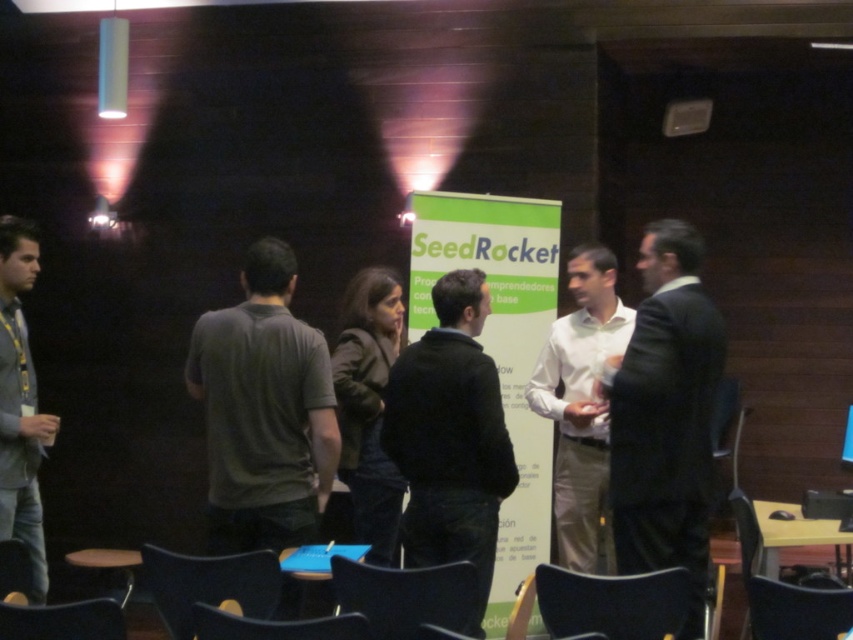
Does dark blue sweater at center lie behind matte black chair at lower left?

That is True.

Between dark blue sweater at center and matte black chair at lower left, which one has less height?

With less height is matte black chair at lower left.

Measure the distance between dark blue sweater at center and camera.

The distance of dark blue sweater at center from camera is 8.73 feet.

At what (x,y) coordinates should I click in order to perform the action: click on dark blue sweater at center. Please return your answer as a coordinate pair (x, y). The image size is (853, 640). Looking at the image, I should click on (450, 436).

Is dark blue sweater at center behind black plastic chair at lower right?

Yes.

Which is behind, point (457, 346) or point (753, 524)?

The point (753, 524) is behind.

Locate an element on the screen. The height and width of the screenshot is (640, 853). dark blue sweater at center is located at coordinates (450, 436).

The width and height of the screenshot is (853, 640). Find the location of `gray fabric jacket at left`. gray fabric jacket at left is located at coordinates (20, 403).

Can you confirm if gray fabric jacket at left is shorter than black plastic chair at lower center?

Incorrect, gray fabric jacket at left's height does not fall short of black plastic chair at lower center's.

Between point (3, 307) and point (392, 588), which one is positioned behind?

The point (3, 307) is behind.

I want to click on gray fabric jacket at left, so click(x=20, y=403).